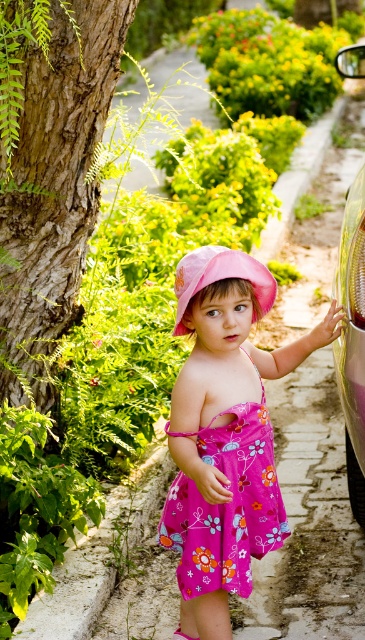
You are a photographer trying to capture the child wearing the pink floral dress at center. Given that the dress is located at coordinates 0.680, 0.616 in the image, where should you position your camera to ensure the dress is centered in your shot?

To center the pink floral dress at center in your shot, position the camera so that the dress is at the image coordinates (224, 435), which is already the specified location for the dress.

The child is wearing a pink floral dress at center and a pink fabric hat at center. Which clothing item is located lower on the child?

The pink floral dress at center is positioned under the pink fabric hat at center, so the dress is lower than the hat.

You are a photographer setting up a shot of the child wearing the pink fabric hat at center. You want to include the shiny metallic car at right in the background but ensure it doesn t overpower the main subject. Based on their sizes, is this feasible?

The shiny metallic car at right is bigger than pink fabric hat at center. However, since the car is in the background, its larger size can be managed by adjusting the camera angle or composition to keep the pink fabric hat at center as the focal point without the car overshadowing it.